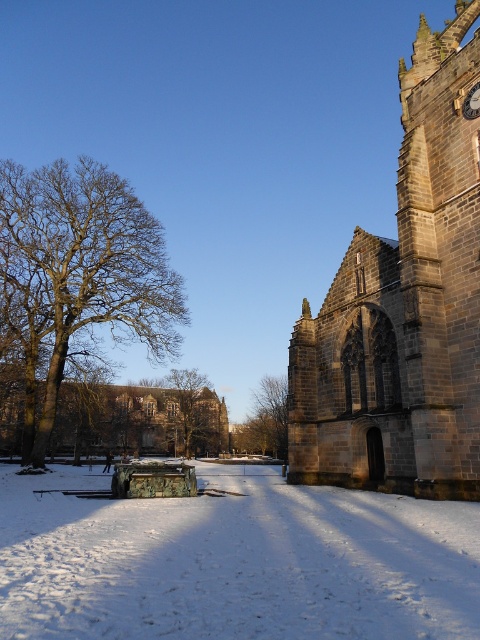
You are standing in front of the historic stone building and want to check the time on the gold metallic clock at upper right. However, there is a brown leafless tree at center blocking your view. Can you see the clock clearly from your current position?

The gold metallic clock at upper right is behind the brown leafless tree at center, so the tree is blocking your view of the clock. You cannot see the clock clearly from your current position.

You are standing in the winter scene and want to take a photo of both the brown stone church at right and the brown leafless tree at left. Which object should you focus on first if you want to include both in the frame without moving your camera?

You should focus on the brown leafless tree at left first because it is closer to you than the brown stone church at right, allowing both to be in the frame without moving the camera.

You are standing in front of the historic stone building and notice two points marked on the image. Which point, point (465, 429) or point (127, 198), is closer to you?

Point (465, 429) is closer to the viewer than point (127, 198).